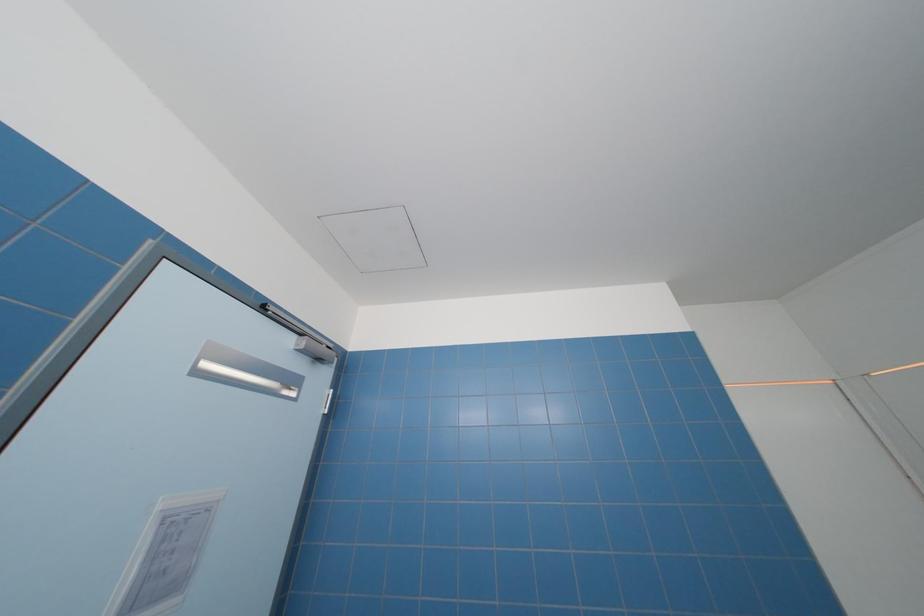
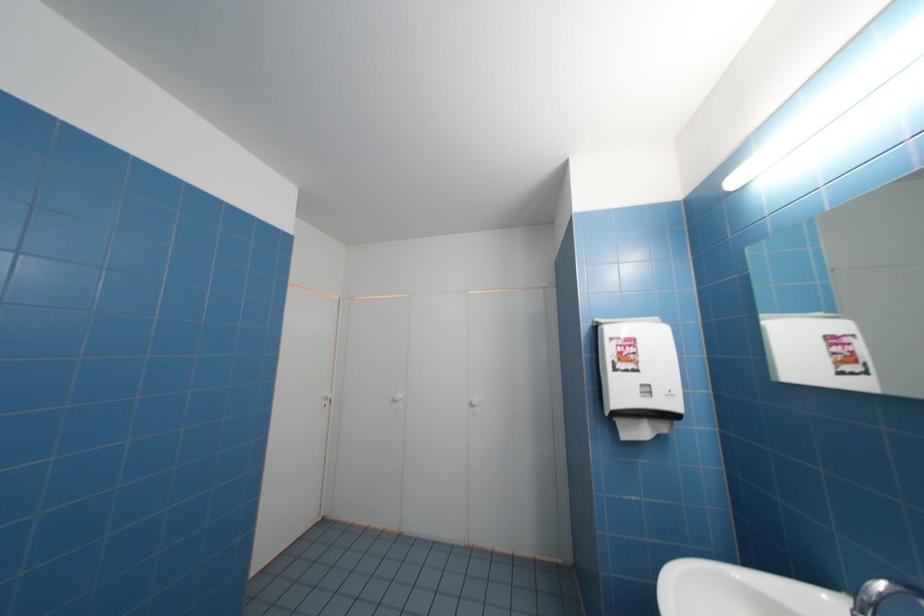
Question: Based on the continuous images, in which direction is the camera rotating? Reply with the corresponding letter.

Choices:
 (A) Left
 (B) Right
 (C) Up
 (D) Down

Answer: (B)